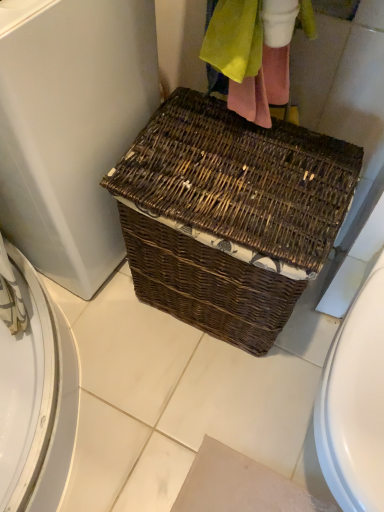
Question: Is brown wicker basket at center bigger or smaller than brown wicker basket at center?

Choices:
 (A) big
 (B) small

Answer: (B)

Question: Visually, is brown wicker basket at center positioned to the left or to the right of brown wicker basket at center?

Choices:
 (A) left
 (B) right

Answer: (B)

Question: From a real-world perspective, is brown wicker basket at center above or below brown wicker basket at center?

Choices:
 (A) above
 (B) below

Answer: (B)

Question: In terms of width, does brown wicker basket at center look wider or thinner when compared to brown wicker basket at center?

Choices:
 (A) thin
 (B) wide

Answer: (B)

Question: Choose the correct answer: Is brown wicker basket at center inside brown wicker basket at center or outside it?

Choices:
 (A) outside
 (B) inside

Answer: (A)

Question: Based on their sizes in the image, would you say brown wicker basket at center is bigger or smaller than brown wicker basket at center?

Choices:
 (A) small
 (B) big

Answer: (B)

Question: From the image's perspective, is brown wicker basket at center located above or below brown wicker basket at center?

Choices:
 (A) below
 (B) above

Answer: (B)